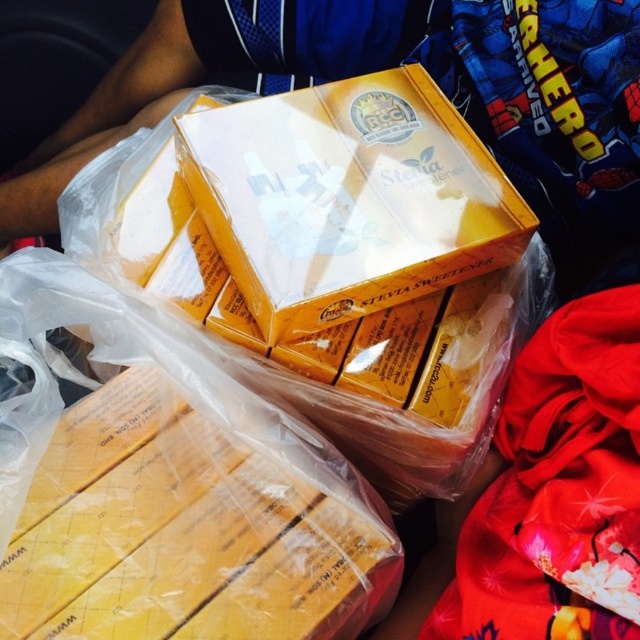
Question: Does yellow cardboard box at lower left lie behind yellow cardboard box at center?

Choices:
 (A) yes
 (B) no

Answer: (B)

Question: Which point is farther to the camera?

Choices:
 (A) (38, 476)
 (B) (285, 244)

Answer: (B)

Question: Which point is farther to the camera?

Choices:
 (A) yellow cardboard box at center
 (B) yellow cardboard box at lower left

Answer: (A)

Question: Does yellow cardboard box at lower left have a larger size compared to yellow cardboard box at center?

Choices:
 (A) yes
 (B) no

Answer: (B)

Question: Does yellow cardboard box at lower left have a larger size compared to yellow cardboard box at center?

Choices:
 (A) yes
 (B) no

Answer: (B)